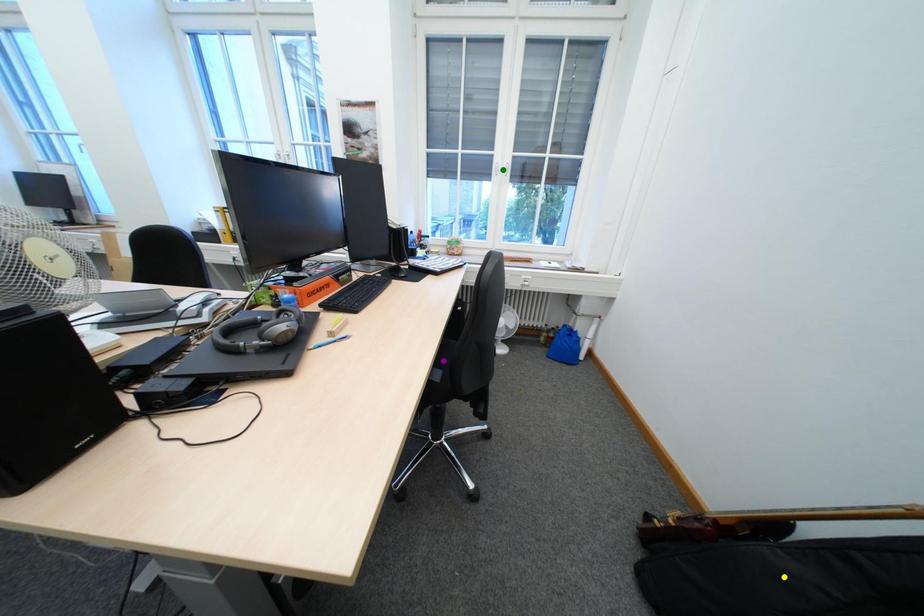
Order these from nearest to farthest:
- purple point
- green point
- yellow point

green point < purple point < yellow point